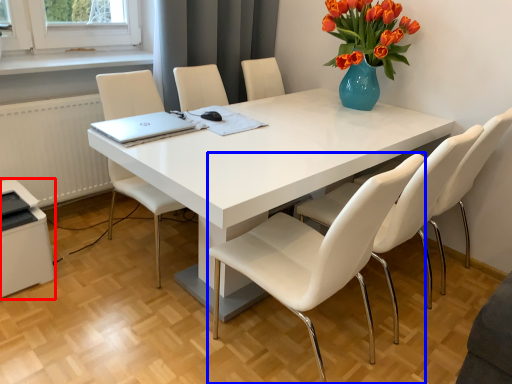
Question: Which object appears closest to the camera in this image, printer (highlighted by a red box) or chair (highlighted by a blue box)?

Choices:
 (A) printer
 (B) chair

Answer: (B)